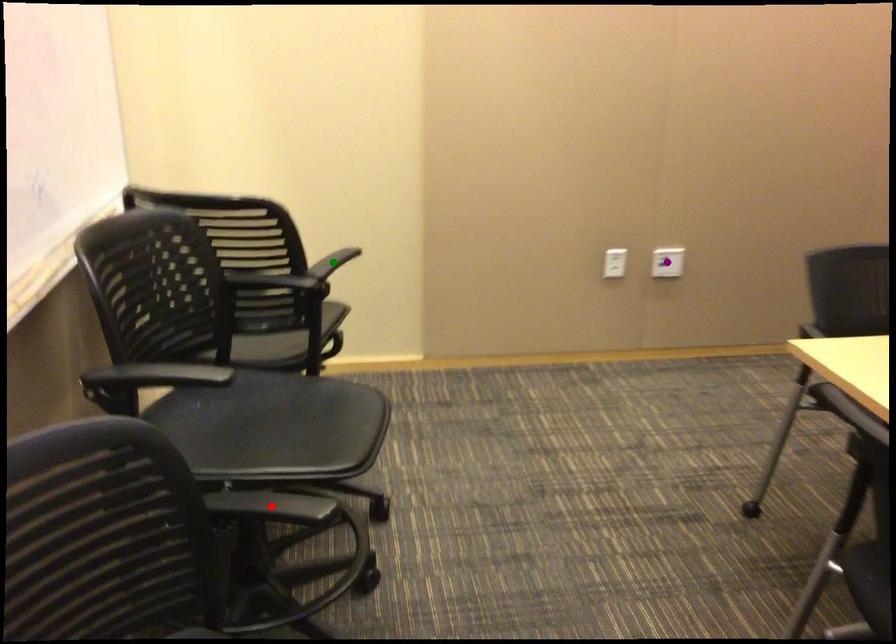
Order these from nearest to farthest:
A) purple point
B) red point
C) green point

1. purple point
2. green point
3. red point